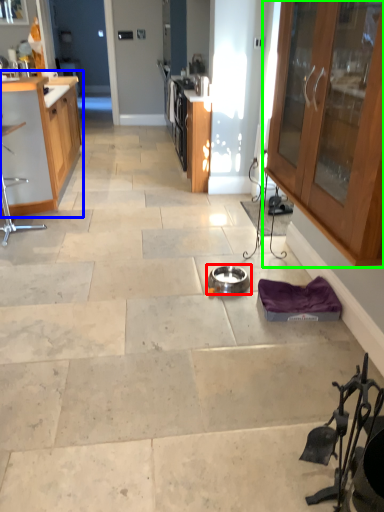
Question: Considering the real-world distances, which object is closest to appliance (highlighted by a red box)? cabinetry (highlighted by a blue box) or cabinetry (highlighted by a green box).

Choices:
 (A) cabinetry
 (B) cabinetry

Answer: (B)